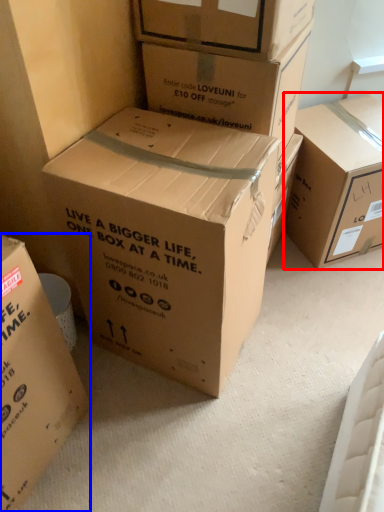
Question: Among these objects, which one is nearest to the camera, box (highlighted by a red box) or box (highlighted by a blue box)?

Choices:
 (A) box
 (B) box

Answer: (B)